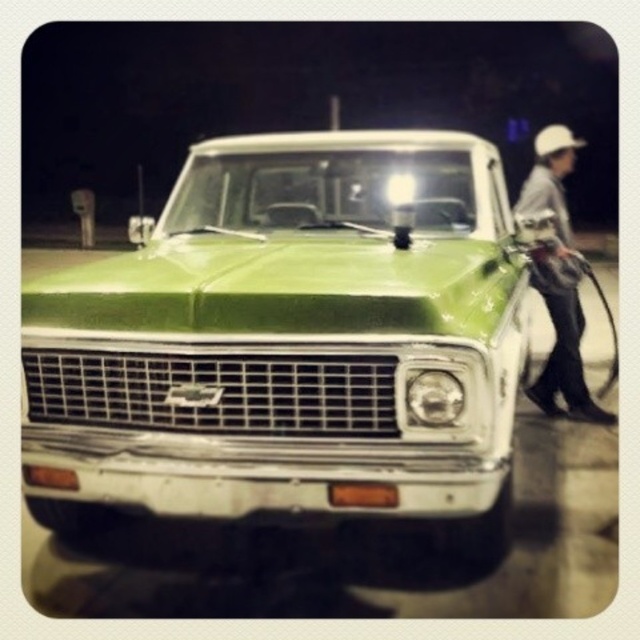
Does green glossy truck at center have a lesser height compared to white hard hat at right?

Yes.

Is point (337, 355) in front of point (576, 362)?

Yes.

The width and height of the screenshot is (640, 640). What are the coordinates of `green glossy truck at center` in the screenshot? It's located at (291, 342).